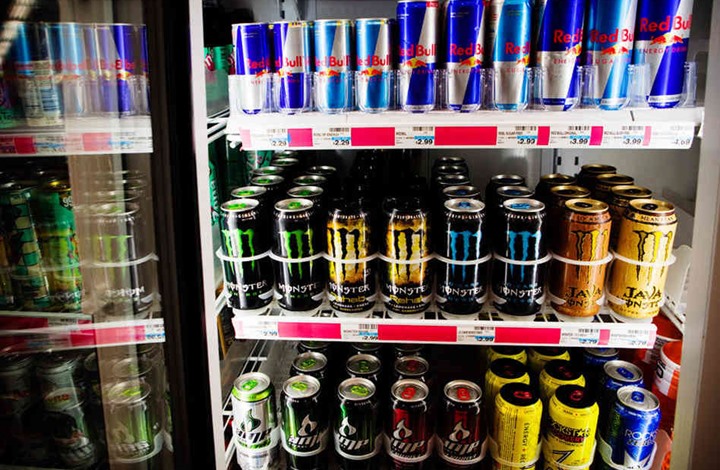
At what (x,y) coordinates should I click in order to perform the action: click on shelf trays. Please return your answer as a coordinate pair (x, y). The height and width of the screenshot is (470, 720). Looking at the image, I should click on (462, 133), (438, 331), (24, 143), (99, 331).